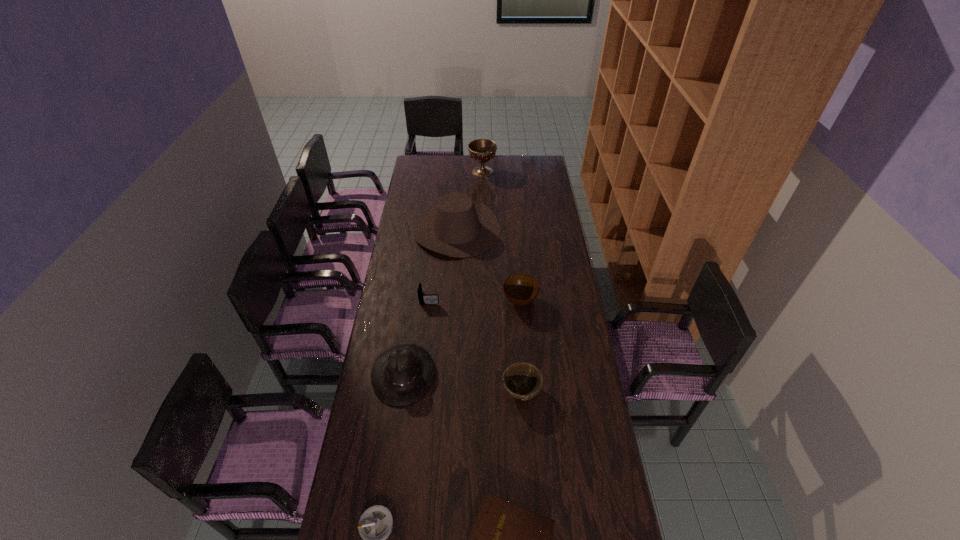
Where is `vacant region located 0.130m on the front of the nearer bowl`? Image resolution: width=960 pixels, height=540 pixels. vacant region located 0.130m on the front of the nearer bowl is located at coordinates (525, 443).

At what (x,y) coordinates should I click in order to perform the action: click on free space located on the outer surface of the third shortest object. Please return your answer as a coordinate pair (x, y). Looking at the image, I should click on (509, 298).

The height and width of the screenshot is (540, 960). In order to click on object located at the far edge in this screenshot , I will do `click(482, 150)`.

Find the location of a particular element. cowboy hat located in the left edge section of the desktop is located at coordinates (459, 227).

Image resolution: width=960 pixels, height=540 pixels. I want to click on hat that is at the left edge, so click(x=401, y=375).

Locate an element on the screen. wallet present at the left edge is located at coordinates (430, 299).

Identify the location of vacant space at the far edge of the desktop. (487, 165).

Where is `vacant space at the left edge of the desktop`? vacant space at the left edge of the desktop is located at coordinates (408, 190).

The image size is (960, 540). Find the location of `vacant space at the right edge of the desktop`. vacant space at the right edge of the desktop is located at coordinates (556, 239).

Image resolution: width=960 pixels, height=540 pixels. I want to click on vacant region at the far left corner, so click(x=420, y=174).